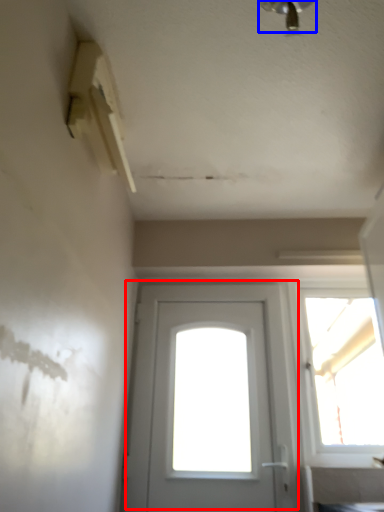
Question: Which of the following is the farthest to the observer, door (highlighted by a red box) or light fixture (highlighted by a blue box)?

Choices:
 (A) door
 (B) light fixture

Answer: (A)